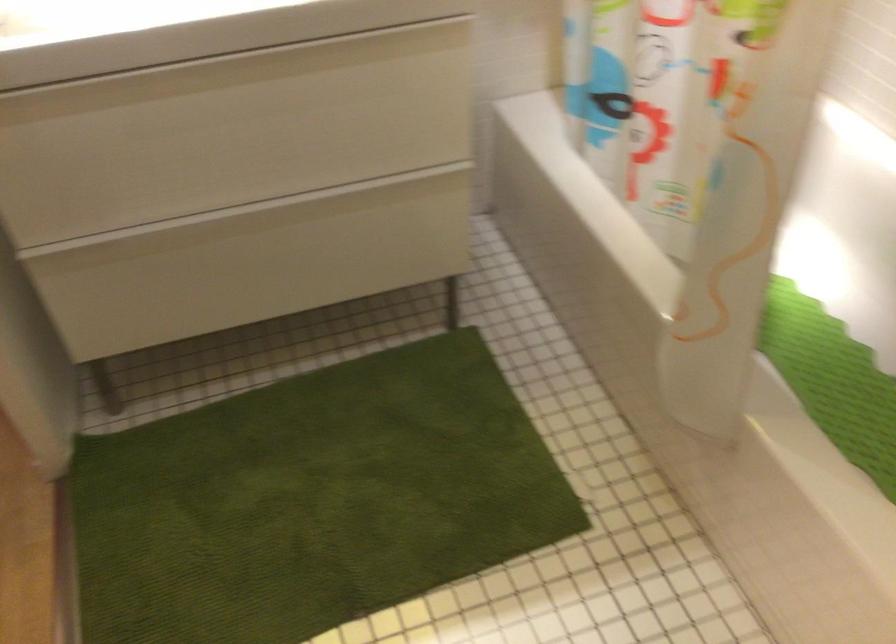
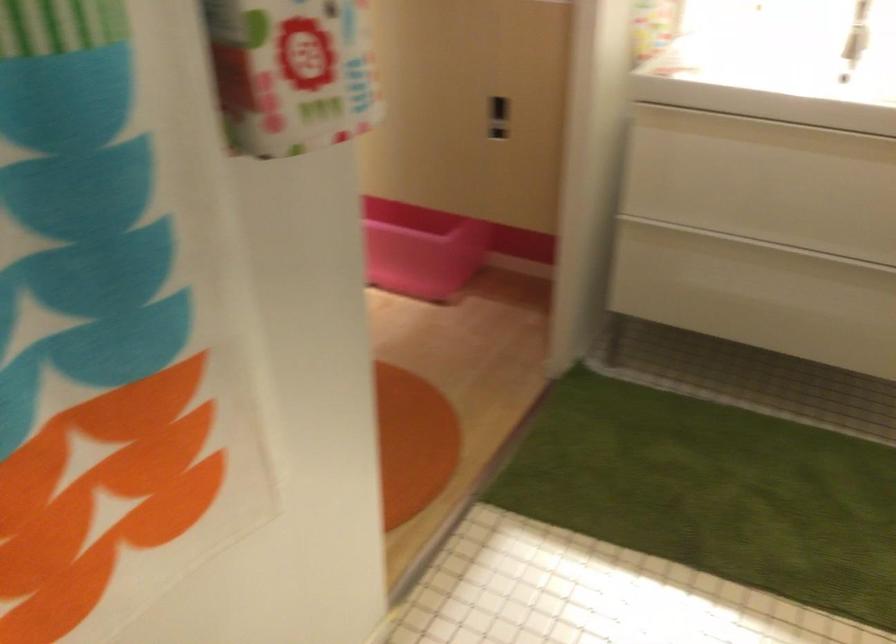
Where in the second image is the point corresponding to (153,99) from the first image?

(764, 131)